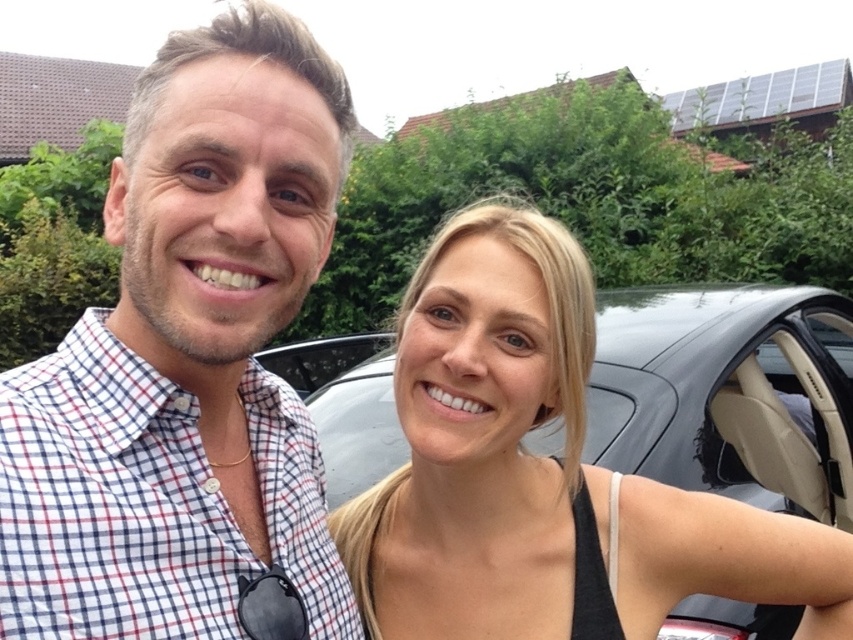
Question: Is checkered fabric shirt at center below black matte tank top at right?

Choices:
 (A) no
 (B) yes

Answer: (A)

Question: Which of the following is the closest to the observer?

Choices:
 (A) (227, 298)
 (B) (519, 636)

Answer: (A)

Question: Among these objects, which one is nearest to the camera?

Choices:
 (A) checkered fabric shirt at center
 (B) black matte tank top at right

Answer: (A)

Question: Is checkered fabric shirt at center wider than black matte tank top at right?

Choices:
 (A) yes
 (B) no

Answer: (B)

Question: Among these points, which one is farthest from the camera?

Choices:
 (A) (439, 294)
 (B) (241, 131)

Answer: (A)

Question: Does checkered fabric shirt at center have a smaller size compared to black matte tank top at right?

Choices:
 (A) yes
 (B) no

Answer: (A)